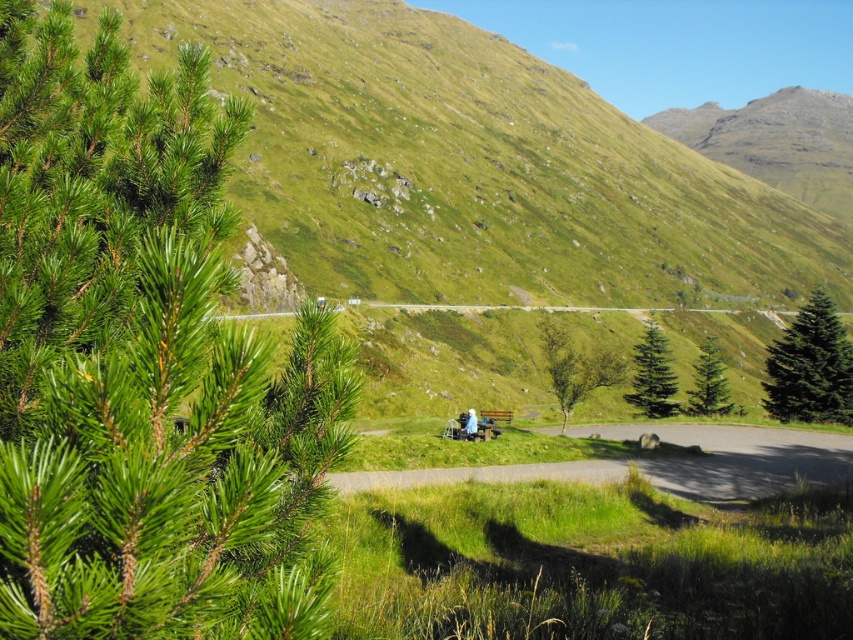
Question: Which of the following is the farthest from the observer?

Choices:
 (A) (584, 436)
 (B) (468, 436)

Answer: (A)

Question: Does gravel path at center have a smaller size compared to green fir tree at right?

Choices:
 (A) yes
 (B) no

Answer: (B)

Question: Is gravel path at center in front of green leafy tree at center?

Choices:
 (A) yes
 (B) no

Answer: (A)

Question: Observing the image, what is the correct spatial positioning of green fir tree at right in reference to light blue fabric at center?

Choices:
 (A) above
 (B) below

Answer: (A)

Question: Which point is farther to the camera?

Choices:
 (A) (711, 394)
 (B) (805, 353)

Answer: (A)

Question: Which of the following is the farthest from the observer?

Choices:
 (A) (566, 417)
 (B) (631, 392)
 (C) (602, 481)

Answer: (B)